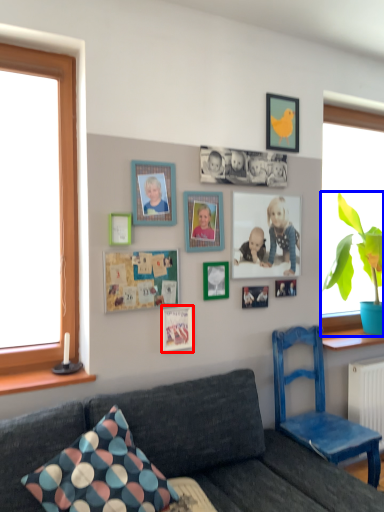
Question: Which point is closer to the camera, picture frame (highlighted by a red box) or houseplant (highlighted by a blue box)?

Choices:
 (A) picture frame
 (B) houseplant

Answer: (A)